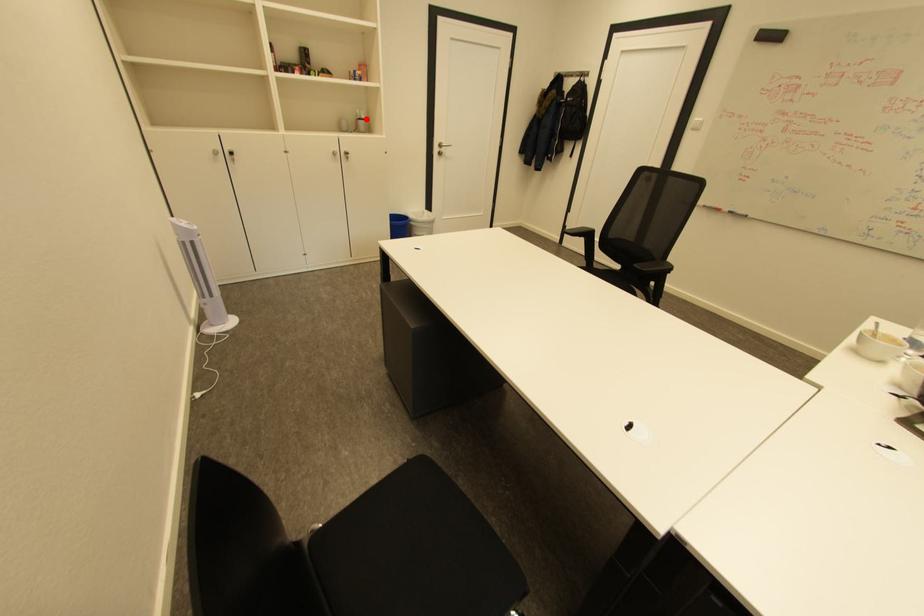
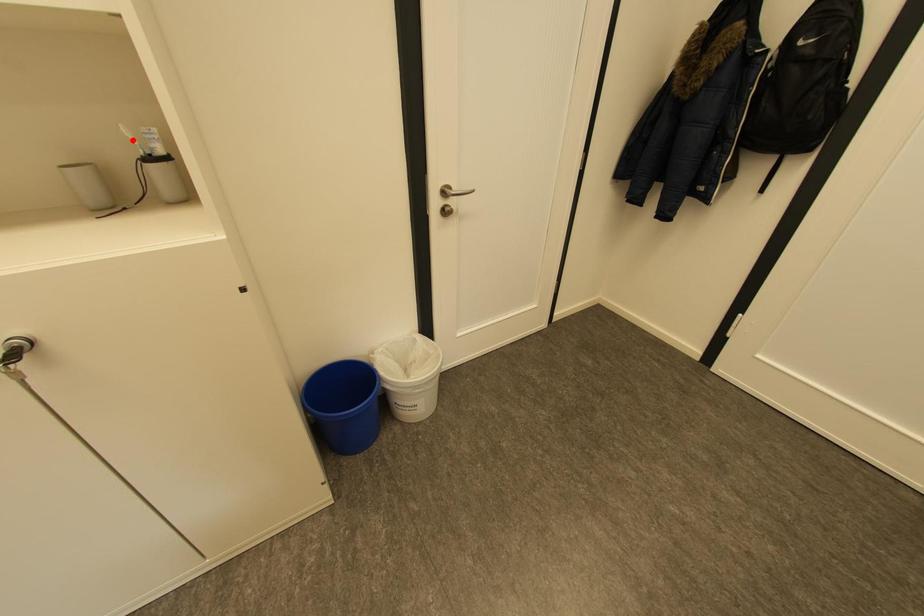
I am providing you with two images of the same scene from different viewpoints. A red point is marked on the first image and another point is marked on the second image. Is the marked point in image1 the same physical position as the marked point in image2?

No